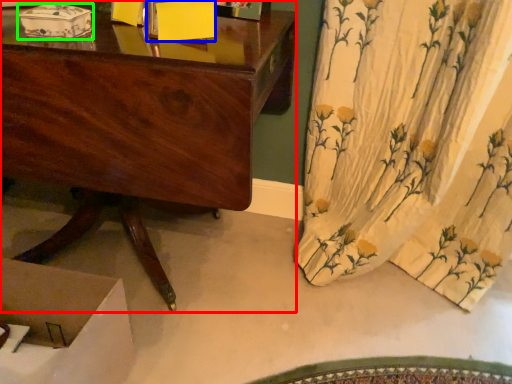
Question: Which object is positioned closest to desk (highlighted by a red box)? Select from box (highlighted by a blue box) and box (highlighted by a green box).

Choices:
 (A) box
 (B) box

Answer: (A)